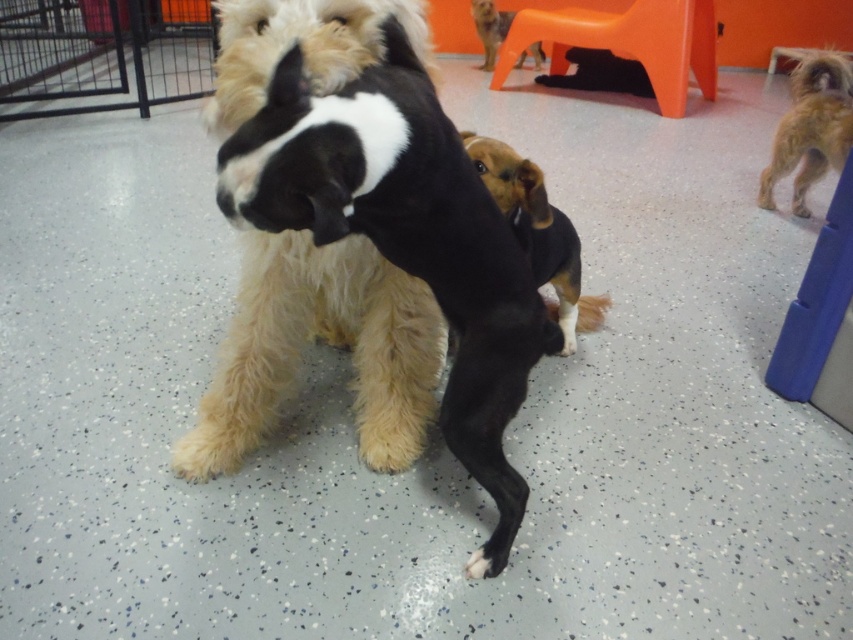
Where is the shaggy golden dog at right located in the image?

The shaggy golden dog at right is located at point (810, 125) in the image.

You are a dog owner who wants to buy a new dog bed for both the brown furry dog at center and the shaggy golden dog at right. Based on their sizes, which dog would require a larger bed?

The brown furry dog at center requires a larger bed since its width is greater than the shaggy golden dog at right.